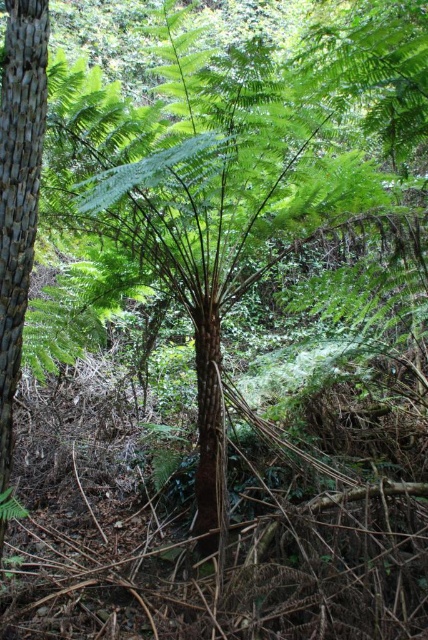
Can you confirm if wooden textured pole at left is taller than brown rough tree trunk at center?

Indeed, wooden textured pole at left has a greater height compared to brown rough tree trunk at center.

Between wooden textured pole at left and brown rough tree trunk at center, which one appears on the left side from the viewer's perspective?

wooden textured pole at left is more to the left.

The width and height of the screenshot is (428, 640). I want to click on wooden textured pole at left, so click(x=18, y=189).